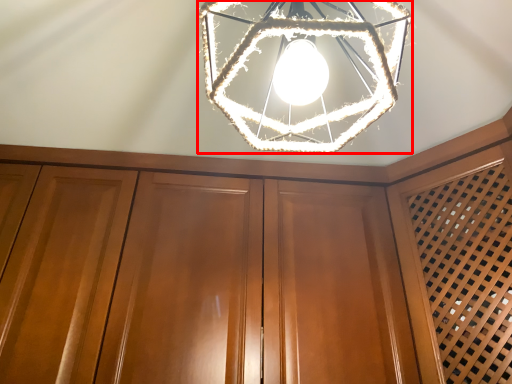
Question: Considering the relative positions of lamp (annotated by the red box) and dresser in the image provided, where is lamp (annotated by the red box) located with respect to the staircase?

Choices:
 (A) right
 (B) left

Answer: (A)